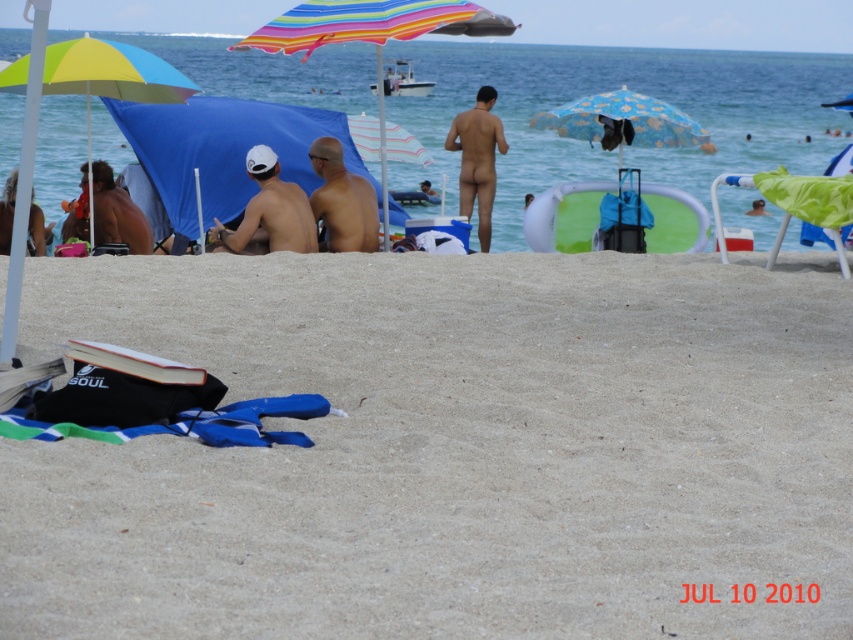
Question: Which point is closer to the camera?

Choices:
 (A) (387, 257)
 (B) (608, 189)

Answer: (A)

Question: Which point is farther to the camera?

Choices:
 (A) click(370, 307)
 (B) click(131, 236)
 (C) click(315, 147)

Answer: (B)

Question: Can you confirm if multicolored fabric umbrella at left is thinner than brown leather backpack at left?

Choices:
 (A) no
 (B) yes

Answer: (A)

Question: Does beige sand at lower center appear on the right side of brown leather backpack at left?

Choices:
 (A) no
 (B) yes

Answer: (B)

Question: Is brown matte skin at center wider than skinny nude man at center?

Choices:
 (A) no
 (B) yes

Answer: (B)

Question: Which object is farther from the camera taking this photo?

Choices:
 (A) beige sand at lower center
 (B) multicolored fabric umbrella at left
 (C) green fabric beach chair at right
 (D) skinny white cap at center

Answer: (D)